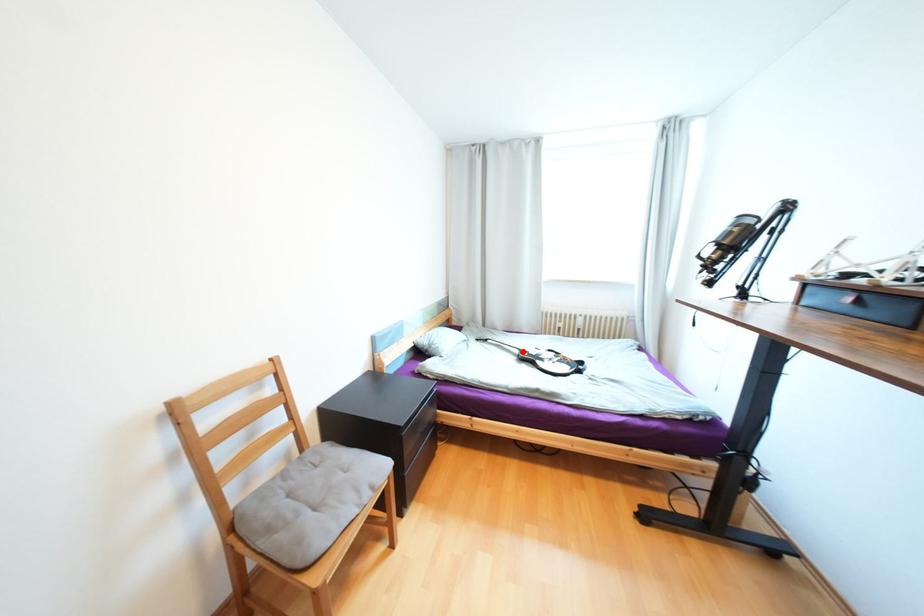
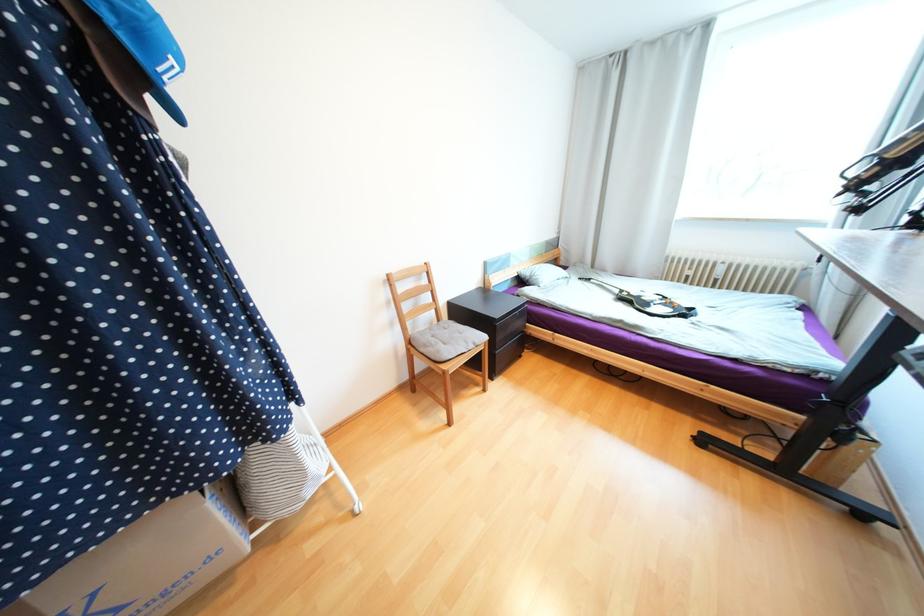
Find the pixel in the second image that matches the highlighted location in the first image.

(623, 292)